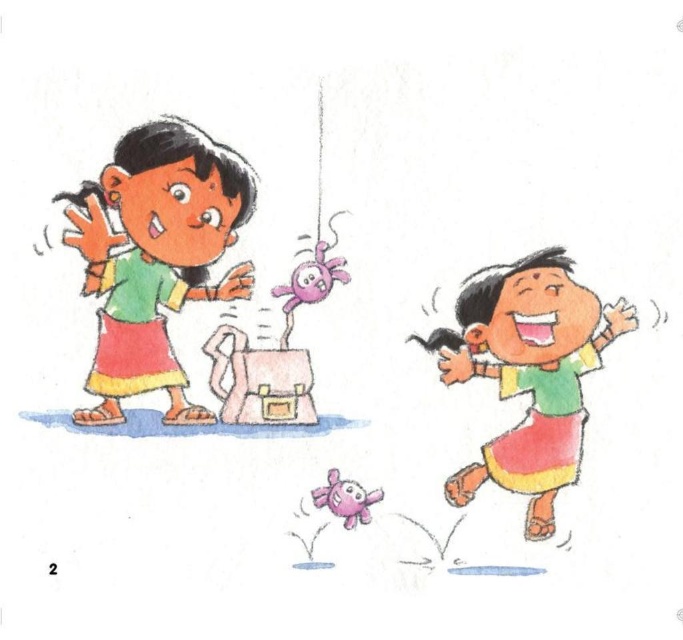
Question: Which point is closer to the camera?

Choices:
 (A) matte green skirt at right
 (B) matte green shirt at left
 (C) matte pink plush at center

Answer: (A)

Question: Can you confirm if matte green skirt at right is positioned to the left of matte pink plush at center?

Choices:
 (A) yes
 (B) no

Answer: (B)

Question: Is the position of matte green shirt at left more distant than that of matte pink plush at center?

Choices:
 (A) no
 (B) yes

Answer: (A)

Question: Can you confirm if matte green shirt at left is positioned to the left of matte green skirt at right?

Choices:
 (A) no
 (B) yes

Answer: (B)

Question: Which is nearer to the matte green shirt at left?

Choices:
 (A) matte green skirt at right
 (B) matte pink plush at center

Answer: (B)

Question: Which point is farther from the camera taking this photo?

Choices:
 (A) (320, 490)
 (B) (482, 364)
 (C) (173, 189)

Answer: (A)